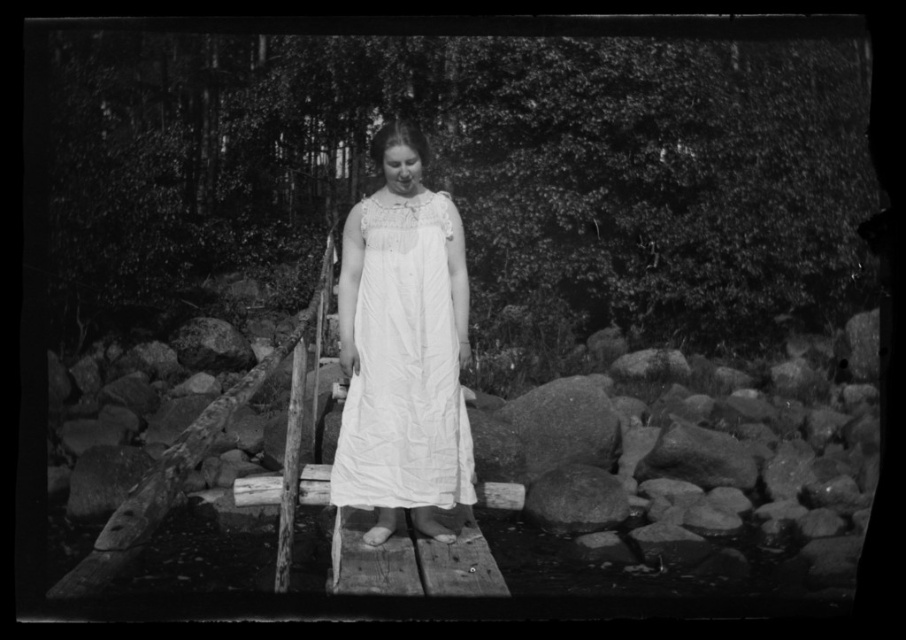
Can you confirm if white cotton dress at center is smaller than granite rock at center?

Yes, white cotton dress at center is smaller than granite rock at center.

Which is more to the left, white cotton dress at center or granite rock at center?

white cotton dress at center

Measure the distance between white cotton dress at center and camera.

white cotton dress at center is 4.46 meters from camera.

Find the location of a particular element. This screenshot has height=640, width=906. white cotton dress at center is located at coordinates (403, 368).

Who is positioned more to the right, granite rock at center or smooth gray rock at lower center?

smooth gray rock at lower center

Is granite rock at center taller than smooth gray rock at lower center?

Correct, granite rock at center is much taller as smooth gray rock at lower center.

This screenshot has height=640, width=906. What do you see at coordinates (564, 424) in the screenshot? I see `granite rock at center` at bounding box center [564, 424].

Locate an element on the screen. granite rock at center is located at coordinates (564, 424).

This screenshot has width=906, height=640. What do you see at coordinates (403, 368) in the screenshot?
I see `white cotton dress at center` at bounding box center [403, 368].

Is white cotton dress at center shorter than smooth gray rock at lower center?

No, white cotton dress at center is not shorter than smooth gray rock at lower center.

Does point (415, 358) lie behind point (590, 496)?

No.

Identify the location of white cotton dress at center. This screenshot has height=640, width=906. (403, 368).